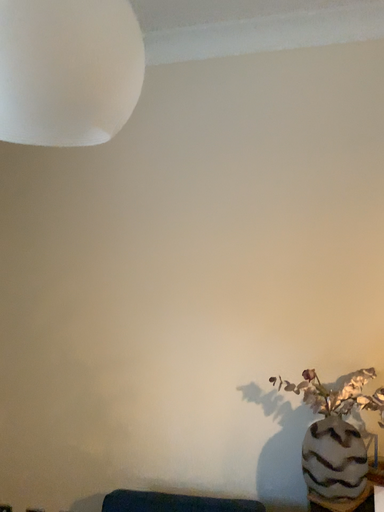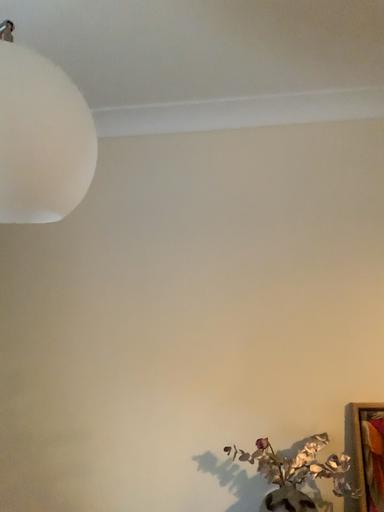
Question: Which way did the camera rotate in the video?

Choices:
 (A) rotated upward
 (B) rotated downward

Answer: (A)